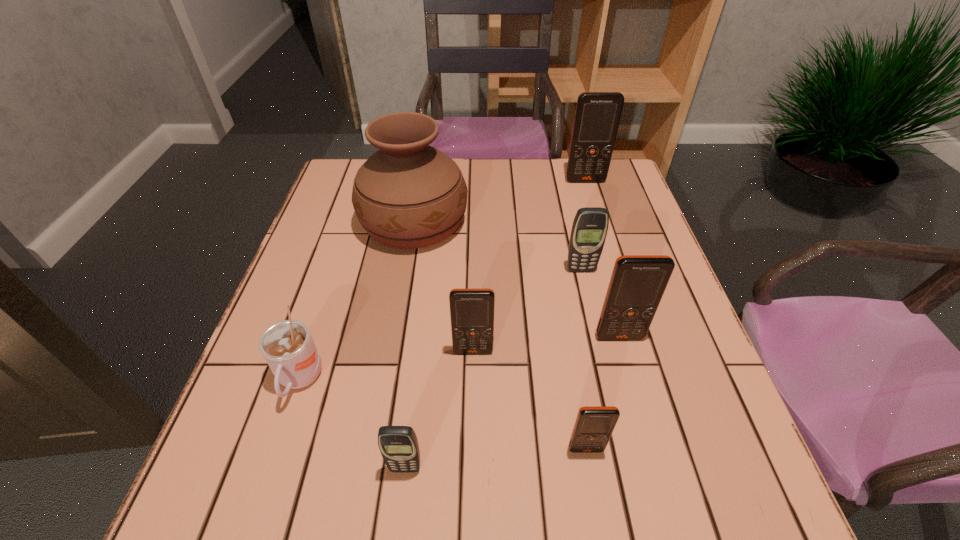
This screenshot has height=540, width=960. Find the location of `the second farthest object`. the second farthest object is located at coordinates (407, 195).

Find the location of a particular element. the tallest cellular telephone is located at coordinates (597, 116).

This screenshot has height=540, width=960. I want to click on the biggest orange cellular telephone, so click(x=597, y=116).

You are a GUI agent. You are given a task and a screenshot of the screen. Output one action in this format:
    pyautogui.click(x=<x>, y=<y>)
    Task: Click on the fourth farthest object
    
    Given the screenshot: What is the action you would take?
    pyautogui.click(x=638, y=282)

Identify the location of the third tallest object. The image size is (960, 540). 638,282.

At what (x,y) coordinates should I click in order to perform the action: click on the third farthest object. Please return your answer as a coordinate pair (x, y). The image size is (960, 540). Looking at the image, I should click on (590, 225).

What are the coordinates of `the second farthest cellular telephone` in the screenshot? It's located at (590, 225).

At what (x,y) coordinates should I click in order to perform the action: click on the fifth cellular telephone from right to left. Please return your answer as a coordinate pair (x, y). This screenshot has width=960, height=540. Looking at the image, I should click on (471, 310).

This screenshot has height=540, width=960. Find the location of `the second smallest orange cellular telephone`. the second smallest orange cellular telephone is located at coordinates (471, 310).

In order to click on cup in this screenshot , I will do `click(287, 346)`.